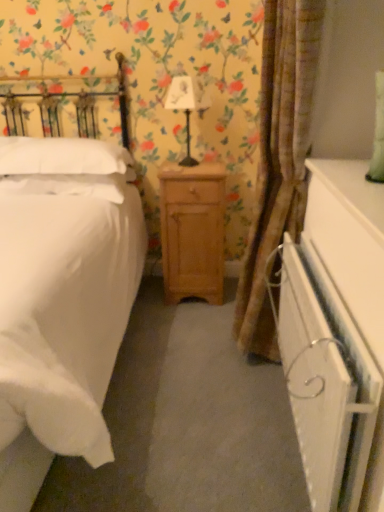
Image resolution: width=384 pixels, height=512 pixels. Find the location of `vacant space underneath white fabric lampshade at center (from a real-world perspective)`. vacant space underneath white fabric lampshade at center (from a real-world perspective) is located at coordinates (188, 164).